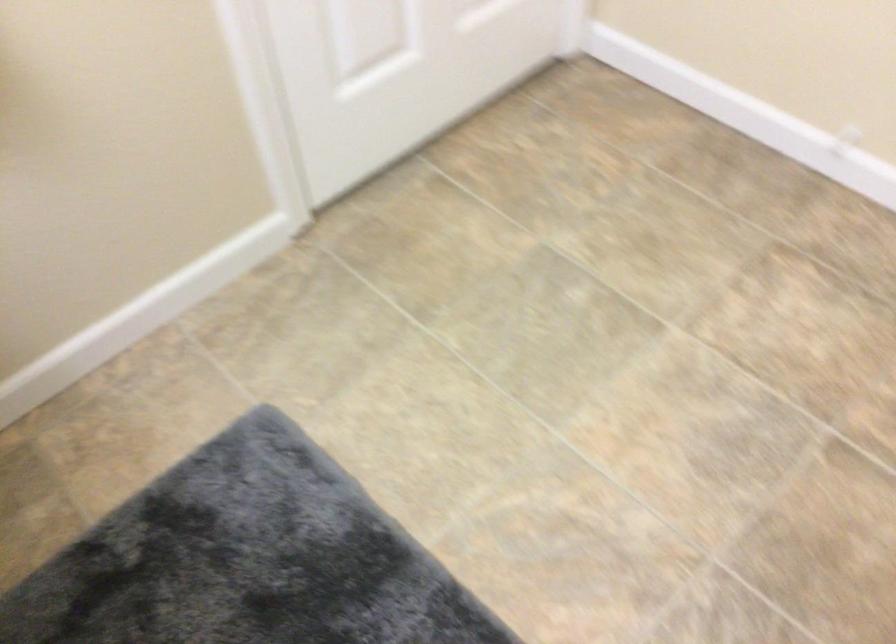
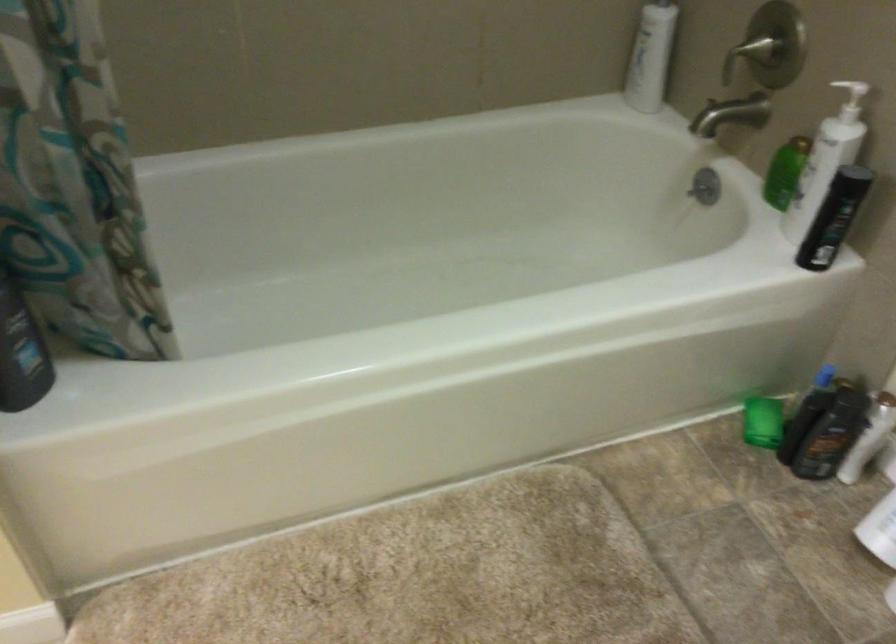
Question: The images are taken continuously from a first-person perspective. In which direction are you moving?

Choices:
 (A) Left
 (B) Right
 (C) Forward
 (D) Backward

Answer: (B)